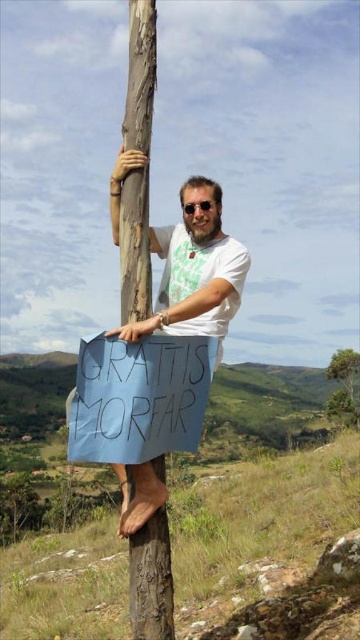
Question: Which object is farther from the camera taking this photo?

Choices:
 (A) green leafy tree at upper right
 (B) natural wood pole at center

Answer: (A)

Question: Does natural wood pole at center have a larger size compared to green leafy tree at lower left?

Choices:
 (A) yes
 (B) no

Answer: (B)

Question: Which object appears closest to the camera in this image?

Choices:
 (A) green leafy tree at lower left
 (B) black plastic goggles at upper center
 (C) natural wood pole at center
 (D) green leafy tree at upper right

Answer: (C)

Question: Which point is farther from the camera taking this photo?

Choices:
 (A) (20, 512)
 (B) (182, 209)
 (C) (124, 134)
 (D) (330, 403)

Answer: (D)

Question: Can you confirm if green leafy tree at lower left is wider than green leafy tree at upper right?

Choices:
 (A) no
 (B) yes

Answer: (B)

Question: Is green leafy tree at upper right wider than black plastic goggles at upper center?

Choices:
 (A) yes
 (B) no

Answer: (A)